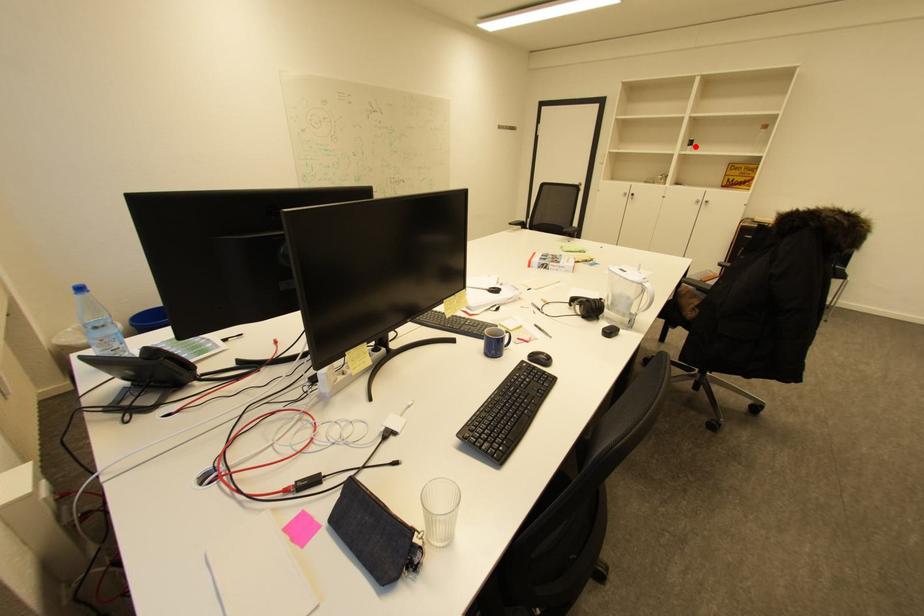
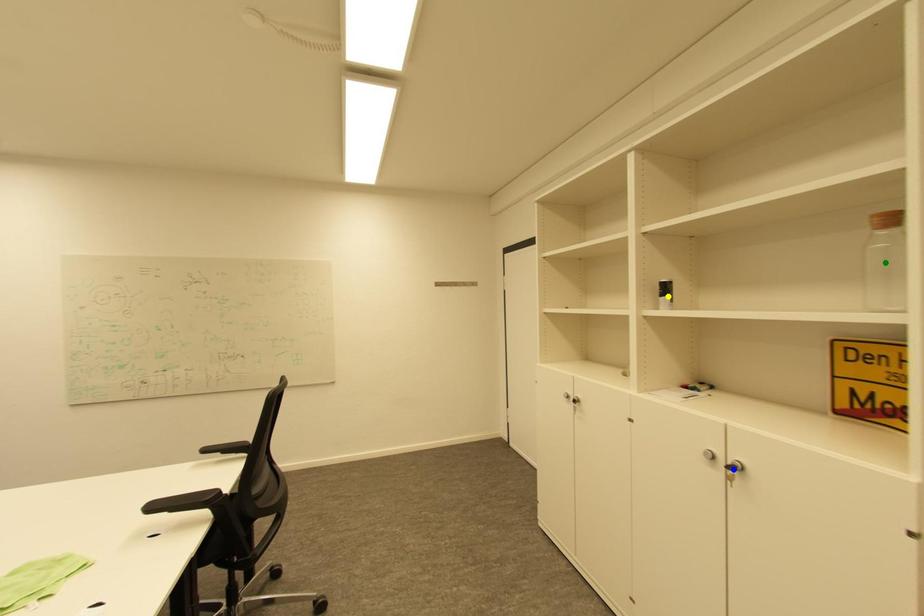
Question: I am providing you with two images of the same scene from different viewpoints. A red point is marked on the first image. You are given multiple points on the second image. Can you choose the point in image 2 that corresponds to the point in image 1?

Choices:
 (A) blue point
 (B) yellow point
 (C) green point

Answer: (B)